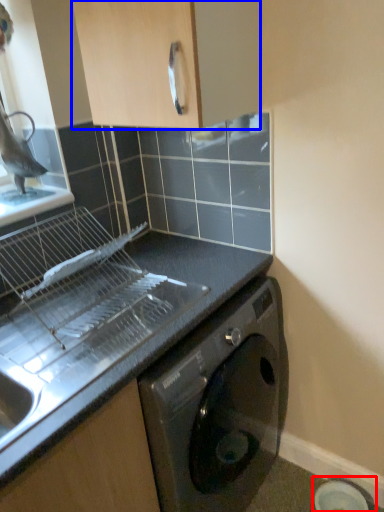
Question: Which object appears farthest to the camera in this image, appliance (highlighted by a red box) or cabinetry (highlighted by a blue box)?

Choices:
 (A) appliance
 (B) cabinetry

Answer: (A)